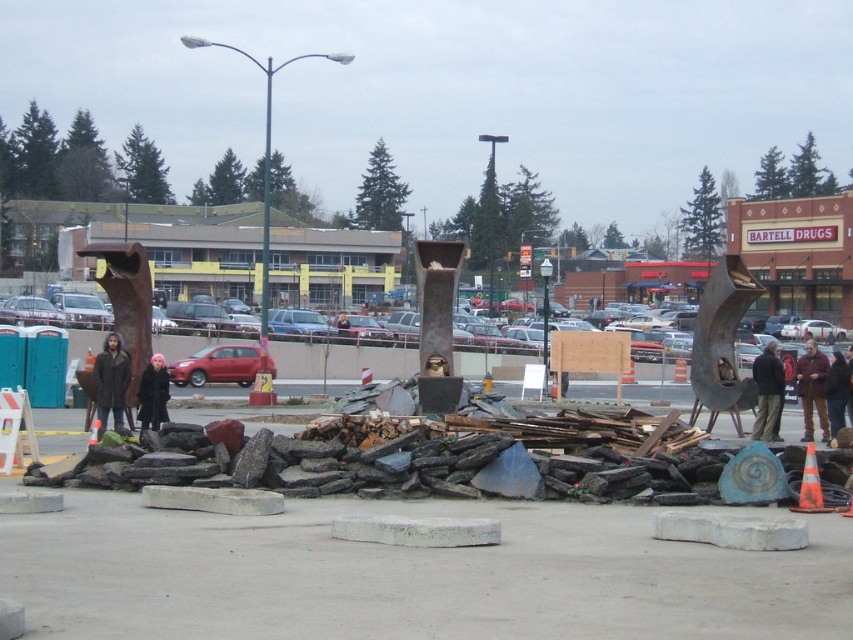
Question: Based on their relative distances, which object is nearer to the dark brown leather jacket at lower right?

Choices:
 (A) dark brown coat at left
 (B) rusty metal sculpture at center
 (C) black wool coat at center
 (D) brown leather jacket at lower right

Answer: (D)

Question: Does brown leather jacket at center appear on the right side of brown leather jacket at lower right?

Choices:
 (A) no
 (B) yes

Answer: (B)

Question: Which point appears farthest from the camera in this image?

Choices:
 (A) (809, 460)
 (B) (82, 348)
 (C) (836, 400)

Answer: (B)

Question: Is dark brown coat at left closer to the viewer compared to black wool coat at center?

Choices:
 (A) yes
 (B) no

Answer: (A)

Question: Among these objects, which one is nearest to the camera?

Choices:
 (A) orange reflective cone at center
 (B) dark brown coat at left

Answer: (A)

Question: Where is rusty metal sculpture at center located in relation to dark brown leather jacket at lower right in the image?

Choices:
 (A) left
 (B) right

Answer: (A)